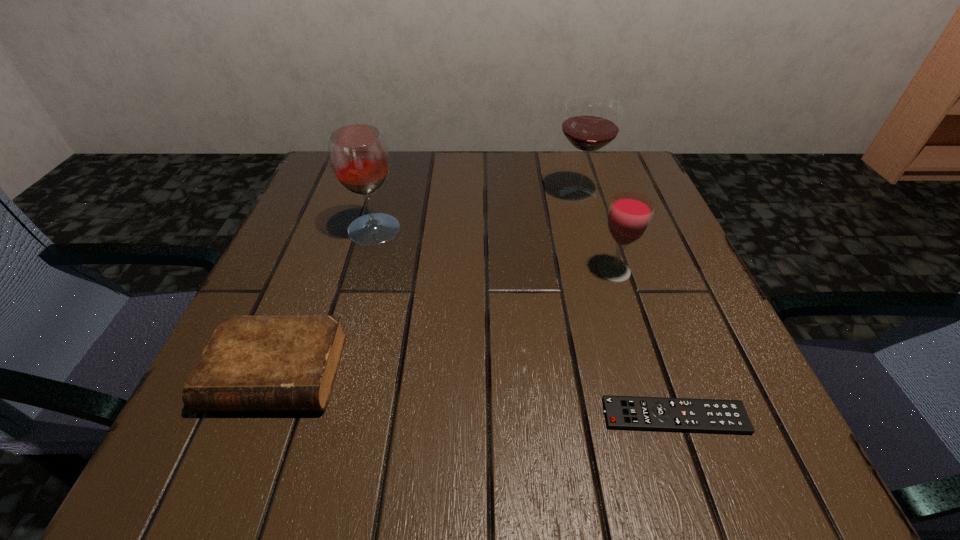
Select which wineglass is the closest to the farthest object. Please provide its 2D coordinates. Your answer should be formatted as a tuple, i.e. [(x, y)], where the tuple contains the x and y coordinates of a point satisfying the conditions above.

[(629, 216)]

This screenshot has width=960, height=540. I want to click on free space that satisfies the following two spatial constraints: 1. on the front side of the third farthest object; 2. on the left side of the shortest object, so click(x=660, y=416).

This screenshot has height=540, width=960. What are the coordinates of `free location that satisfies the following two spatial constraints: 1. on the spine side of the shortest object; 2. on the right side of the diary` in the screenshot? It's located at (259, 416).